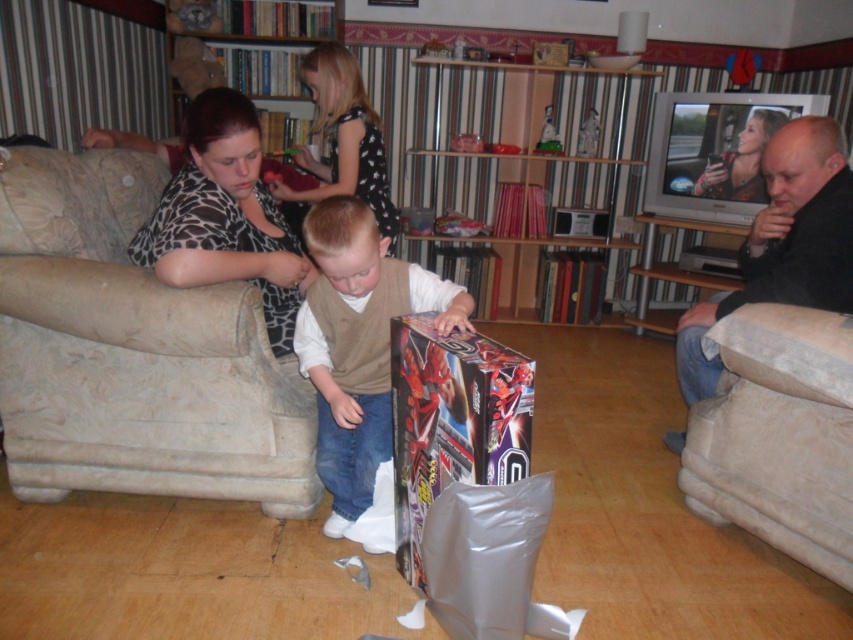
You are a guest entering the living room and want to sit down. Which object, the beige fabric armchair at left or the wooden bookshelf at center, is shorter and thus suitable for sitting?

The beige fabric armchair at left is shorter than the wooden bookshelf at center, making it the suitable option for sitting.

You are a photographer trying to capture a candid shot of the metallic silver toy at center without including the giraffe print blouse at left in the frame. Based on their positions, is this possible?

The giraffe print blouse at left is positioned on the left side of the metallic silver toy at center, so if you position yourself to the right of the metallic silver toy at center, you can capture the metallic silver toy at center without the giraffe print blouse at left in the frame.

You are a guest at the event and want to place a metallic silver toy at center on the wooden bookshelf at upper center. Can you do that without needing a ladder?

The wooden bookshelf at upper center is above the metallic silver toy at center, so it is already positioned higher. Since the toy is at center and the bookshelf is above it, you might need a ladder to reach the shelf unless you can comfortably stretch upwards.